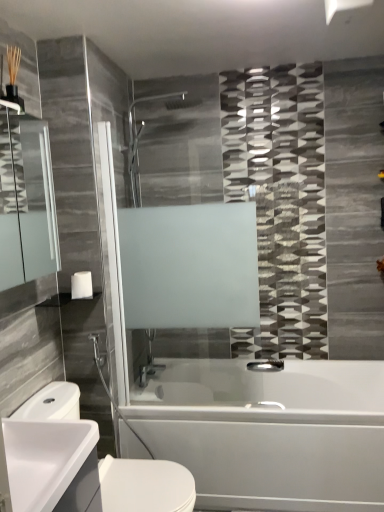
Question: Is point (19, 495) closer or farther from the camera than point (41, 202)?

Choices:
 (A) closer
 (B) farther

Answer: (A)

Question: Looking at their shapes, would you say white glossy sink at lower left is wider or thinner than matte glass mirror at left?

Choices:
 (A) thin
 (B) wide

Answer: (B)

Question: Based on their relative distances, which object is nearer to the white glossy towel bar at upper left?

Choices:
 (A) white glossy sink at lower left
 (B) white glossy sink at lower left
 (C) matte glass mirror at left
 (D) polished chrome faucet at lower center
 (E) white matte toilet paper at lower left

Answer: (C)

Question: Estimate the real-world distances between objects in this image. Which object is farther from the matte glass mirror at left?

Choices:
 (A) polished chrome faucet at lower center
 (B) white matte toilet paper at lower left
 (C) white glossy sink at lower left
 (D) white glossy towel bar at upper left
 (E) white glossy sink at lower left

Answer: (A)